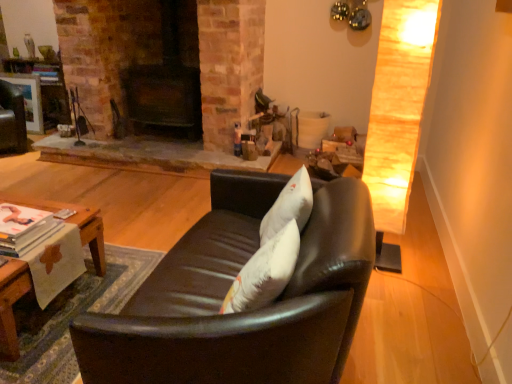
Question: From a real-world perspective, is black leather couch at center under woodenwoodentable at lower left?

Choices:
 (A) yes
 (B) no

Answer: (B)

Question: Considering the relative positions of black leather couch at center and woodenwoodentable at lower left in the image provided, is black leather couch at center behind woodenwoodentable at lower left?

Choices:
 (A) no
 (B) yes

Answer: (A)

Question: Considering the relative sizes of black leather couch at center and woodenwoodentable at lower left in the image provided, is black leather couch at center thinner than woodenwoodentable at lower left?

Choices:
 (A) yes
 (B) no

Answer: (B)

Question: Is black leather couch at center shorter than woodenwoodentable at lower left?

Choices:
 (A) yes
 (B) no

Answer: (B)

Question: Is black leather couch at center to the right of woodenwoodentable at lower left from the viewer's perspective?

Choices:
 (A) no
 (B) yes

Answer: (B)

Question: Do you think woodenwoodentable at lower left is within black leather couch at center, or outside of it?

Choices:
 (A) inside
 (B) outside

Answer: (B)

Question: From a real-world perspective, relative to black leather couch at center, is woodenwoodentable at lower left vertically above or below?

Choices:
 (A) above
 (B) below

Answer: (B)

Question: Is woodenwoodentable at lower left taller or shorter than black leather couch at center?

Choices:
 (A) short
 (B) tall

Answer: (A)

Question: Does point (95, 211) appear closer or farther from the camera than point (214, 188)?

Choices:
 (A) closer
 (B) farther

Answer: (A)

Question: In terms of width, does matte black swivel chair at upper left look wider or thinner when compared to black leather couch at center?

Choices:
 (A) wide
 (B) thin

Answer: (B)

Question: In terms of size, does matte black swivel chair at upper left appear bigger or smaller than black leather couch at center?

Choices:
 (A) big
 (B) small

Answer: (B)

Question: Would you say matte black swivel chair at upper left is to the left or to the right of black leather couch at center in the picture?

Choices:
 (A) right
 (B) left

Answer: (B)

Question: Considering their positions, is matte black swivel chair at upper left located in front of or behind black leather couch at center?

Choices:
 (A) front
 (B) behind

Answer: (B)

Question: Considering the positions of woodenwoodentable at lower left and matte black swivel chair at upper left in the image, is woodenwoodentable at lower left wider or thinner than matte black swivel chair at upper left?

Choices:
 (A) wide
 (B) thin

Answer: (B)

Question: Is woodenwoodentable at lower left to the left or to the right of matte black swivel chair at upper left in the image?

Choices:
 (A) right
 (B) left

Answer: (A)